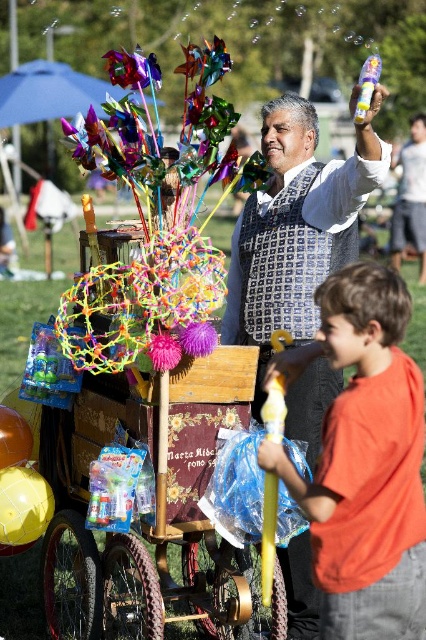
You are a visitor at the park and see the orange matte shirt at right and the patterned fabric vest at center. Which one is closer to your left side?

The orange matte shirt at right is to the left of the patterned fabric vest at center, so the orange matte shirt at right is closer to your left side.

You are a child trying to see both the patterned fabric vest at center and the purple fuzzy ball at center. Which one do you have to look up more to see?

The patterned fabric vest at center has a greater height compared to purple fuzzy ball at center, so you have to look up more to see the patterned fabric vest at center.

You are a photographer trying to capture a photo of the orange matte shirt at right and the purple fuzzy flower at center. Which object should you focus on first to ensure both are in focus without adjusting the camera settings?

You should focus on the orange matte shirt at right first because it is closer to the viewer than the purple fuzzy flower at center. By focusing on the closer object, the flower will still be within the depth of field if they are not too far apart.